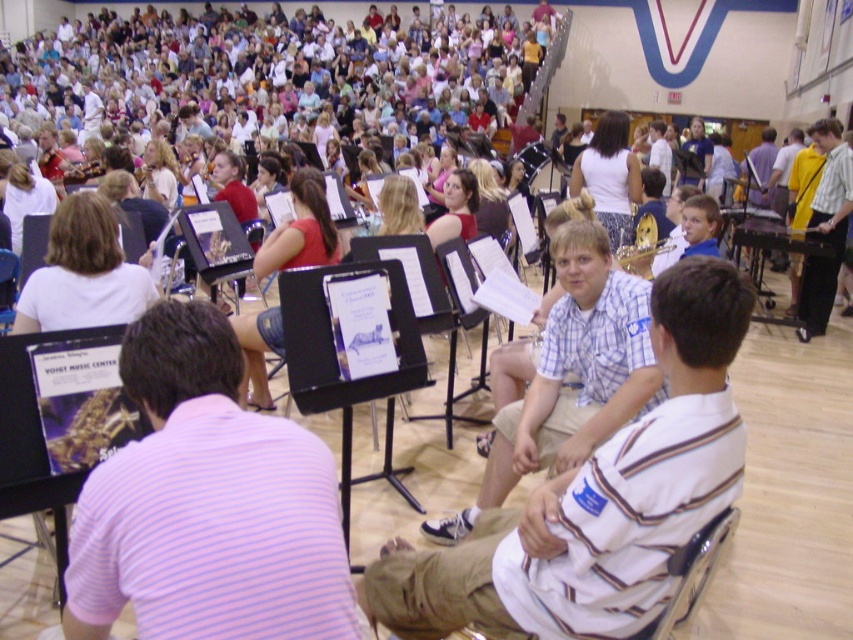
What do you see at coordinates (206, 504) in the screenshot?
I see `purple striped shirt at center` at bounding box center [206, 504].

Does purple striped shirt at center come in front of white cotton shirt at upper center?

Yes.

Between point (148, 385) and point (618, 147), which one is positioned behind?

The point (618, 147) is behind.

You are a GUI agent. You are given a task and a screenshot of the screen. Output one action in this format:
    pyautogui.click(x=<x>, y=<y>)
    Task: Click on the purple striped shirt at center
    This screenshot has width=853, height=640.
    Given the screenshot: What is the action you would take?
    pyautogui.click(x=206, y=504)

Which is below, purple striped shirt at center or plaid shirt at center?

plaid shirt at center is below.

Which of these two, purple striped shirt at center or plaid shirt at center, stands taller?

With more height is plaid shirt at center.

Is point (215, 532) positioned after point (508, 472)?

No, (215, 532) is in front of (508, 472).

At what (x,y) coordinates should I click in order to perform the action: click on purple striped shirt at center. Please return your answer as a coordinate pair (x, y). Image resolution: width=853 pixels, height=640 pixels. Looking at the image, I should click on (206, 504).

Can you confirm if white striped shirt at center is shorter than white cotton shirt at upper center?

Yes, white striped shirt at center is shorter than white cotton shirt at upper center.

Does point (646, 572) come in front of point (604, 220)?

Yes, it is in front of point (604, 220).

The image size is (853, 640). What are the coordinates of `white striped shirt at center` in the screenshot? It's located at (596, 499).